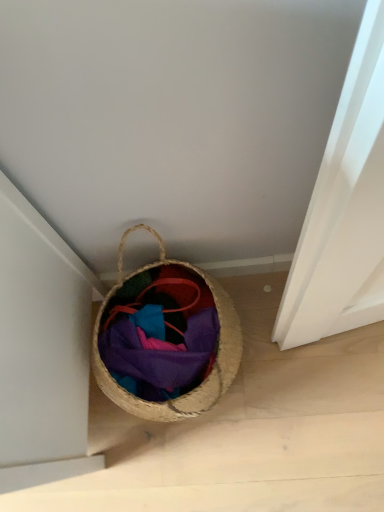
This screenshot has height=512, width=384. I want to click on space that is in front of braided straw basket at lower center, so click(x=218, y=459).